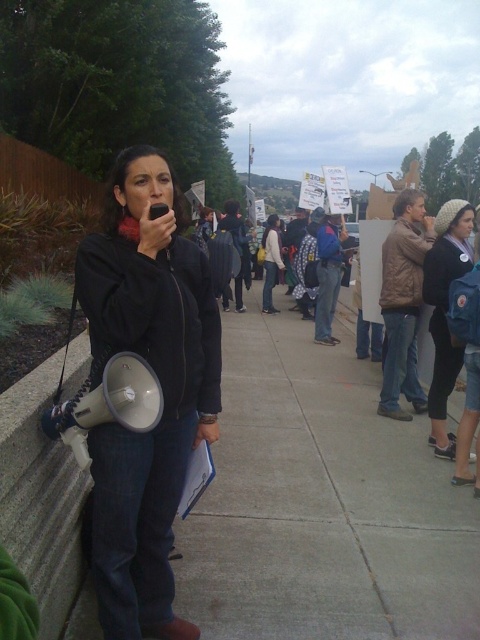
You are standing at the point marked by the coordinate point (428, 323) in the image. Looking around, you see a denim jacket at center. Which direction should you walk to reach the denim jacket at center?

The point (428, 323) marks the location of the denim jacket at center, so you are already at the denim jacket at center.

You are a photographer trying to capture a photo of both the black matte jacket at center and the knitted wool hat at center. Since you want both objects to be clearly visible in the frame, which object should you position closer to the left side of your camera viewfinder?

The black matte jacket at center should be positioned closer to the left side of the camera viewfinder because it is already located to the left of the knitted wool hat at center in the scene.